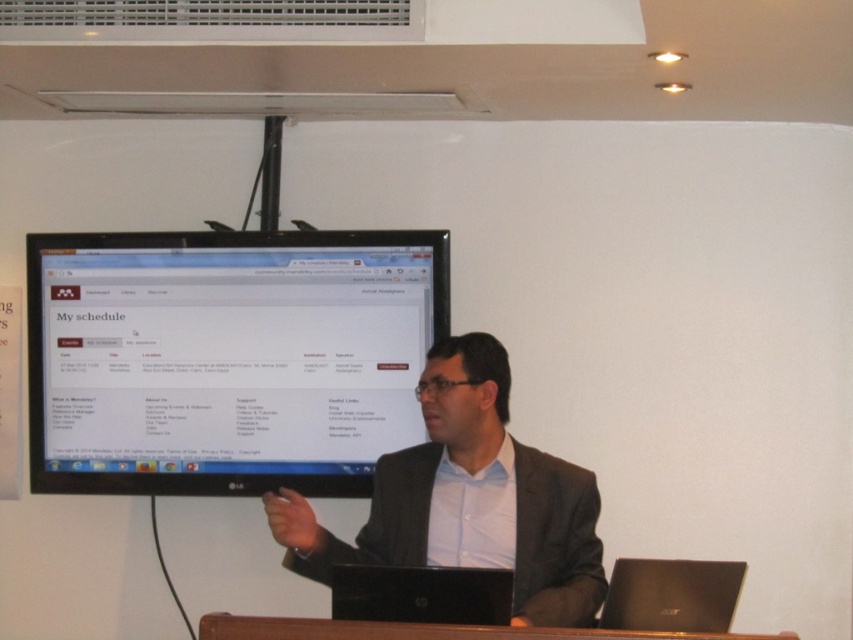
Question: Which point is closer to the camera taking this photo?

Choices:
 (A) (688, 563)
 (B) (347, 387)
 (C) (263, 636)
 (D) (567, 490)

Answer: (C)

Question: Which object is closer to the camera taking this photo?

Choices:
 (A) black glossy monitor at upper center
 (B) black matte laptop at lower right

Answer: (B)

Question: Can you confirm if dark gray suit at center is positioned to the right of black matte laptop at lower right?

Choices:
 (A) no
 (B) yes

Answer: (A)

Question: Does black glossy monitor at upper center appear on the right side of black matte laptop at lower right?

Choices:
 (A) yes
 (B) no

Answer: (B)

Question: Considering the relative positions of black glossy monitor at upper center and dark gray suit at center in the image provided, where is black glossy monitor at upper center located with respect to dark gray suit at center?

Choices:
 (A) left
 (B) right

Answer: (A)

Question: Which point is closer to the camera?

Choices:
 (A) brown wooden table at lower center
 (B) dark gray suit at center
 (C) black glossy monitor at upper center

Answer: (A)